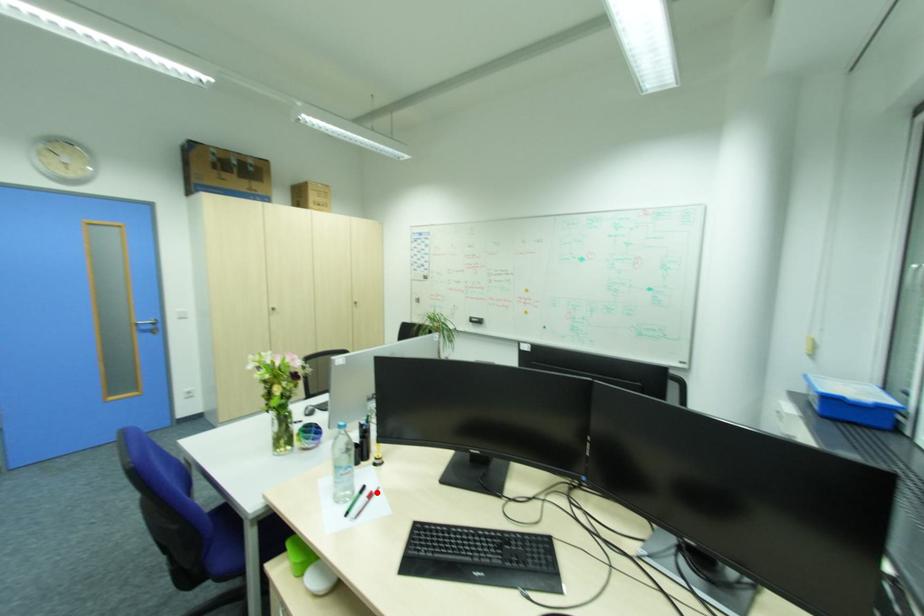
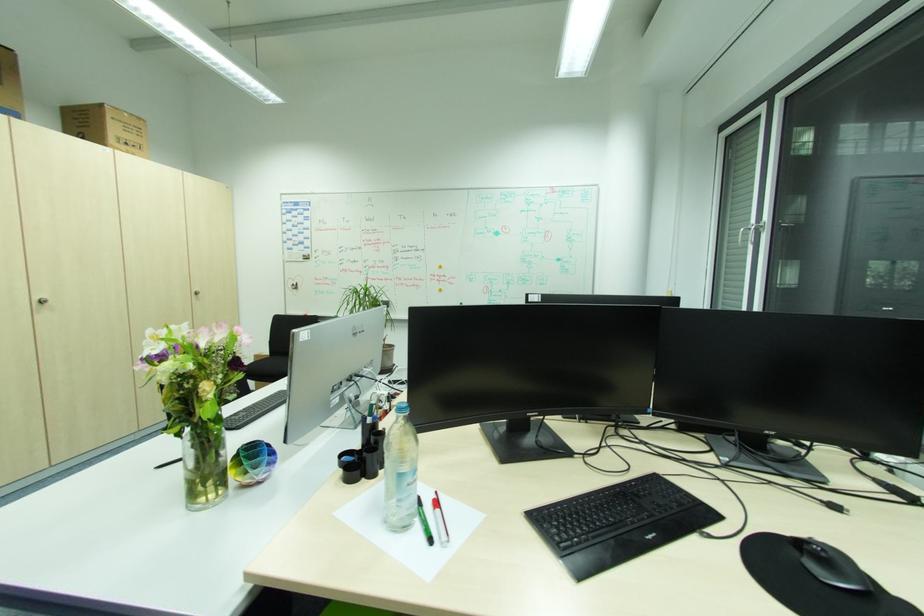
Find the pixel in the second image that matches the highlighted location in the first image.

(440, 500)